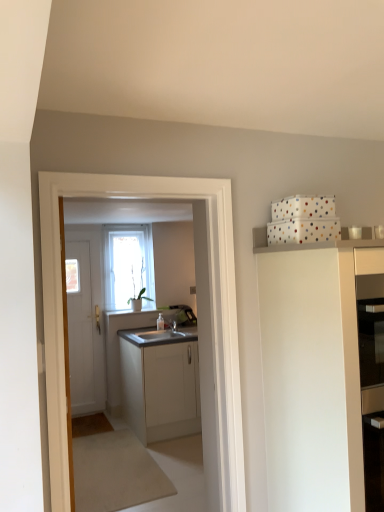
Question: Is point (130, 409) positioned closer to the camera than point (77, 304)?

Choices:
 (A) closer
 (B) farther

Answer: (A)

Question: From the image's perspective, is white matte cabinet at center, which ranks as the first cabinetry in back-to-front order, above or below white matte door at left?

Choices:
 (A) below
 (B) above

Answer: (A)

Question: Which of these objects is positioned farthest from the transparent glass window at center?

Choices:
 (A) white matte door at left
 (B) white matte cabinet at upper right, which is the first cabinetry in right-to-left order
 (C) white matte cabinet at center, the second cabinetry in the right-to-left sequence

Answer: (B)

Question: Based on their relative distances, which object is farther from the white matte cabinet at center, which ranks as the first cabinetry in back-to-front order?

Choices:
 (A) white matte cabinet at upper right, the 2th cabinetry when ordered from back to front
 (B) white matte door at left
 (C) transparent glass window at center

Answer: (A)